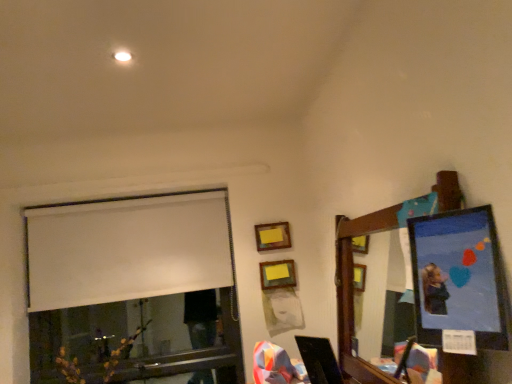
Question: Can you confirm if wooden mirror at upper right is taller than white matte window at upper left?

Choices:
 (A) no
 (B) yes

Answer: (B)

Question: From the image's perspective, is wooden mirror at upper right under white matte window at upper left?

Choices:
 (A) no
 (B) yes

Answer: (B)

Question: Is white matte window at upper left located within wooden mirror at upper right?

Choices:
 (A) yes
 (B) no

Answer: (B)

Question: Considering the relative sizes of wooden mirror at upper right and white matte window at upper left in the image provided, is wooden mirror at upper right thinner than white matte window at upper left?

Choices:
 (A) yes
 (B) no

Answer: (B)

Question: Is wooden mirror at upper right not near white matte window at upper left?

Choices:
 (A) no
 (B) yes

Answer: (B)

Question: From a real-world perspective, is wooden matte picture frame at upper center, the 2th picture frame positioned from the back, positioned above or below wooden picture frame at upper center, which is the 3th picture frame in right-to-left order?

Choices:
 (A) above
 (B) below

Answer: (B)

Question: Considering their positions, is wooden matte picture frame at upper center, the 2th picture frame positioned from the left, located in front of or behind wooden picture frame at upper center, which is the 3th picture frame in right-to-left order?

Choices:
 (A) front
 (B) behind

Answer: (A)

Question: Considering the positions of wooden matte picture frame at upper center, the second picture frame viewed from the front, and wooden picture frame at upper center, the 1th picture frame when ordered from back to front, in the image, is wooden matte picture frame at upper center, the second picture frame viewed from the front, taller or shorter than wooden picture frame at upper center, the 1th picture frame when ordered from back to front,?

Choices:
 (A) tall
 (B) short

Answer: (B)

Question: Looking at the image, does wooden matte picture frame at upper center, the 2th picture frame positioned from the back, seem bigger or smaller compared to wooden picture frame at upper center, the 1th picture frame when ordered from back to front?

Choices:
 (A) small
 (B) big

Answer: (B)

Question: Is matte plastic picture frame at upper right, the third picture frame viewed from the back, wider or thinner than white matte window at upper left?

Choices:
 (A) wide
 (B) thin

Answer: (A)

Question: In terms of size, does matte plastic picture frame at upper right, placed as the 1th picture frame when sorted from right to left, appear bigger or smaller than white matte window at upper left?

Choices:
 (A) big
 (B) small

Answer: (B)

Question: Does point (480, 332) appear closer or farther from the camera than point (123, 312)?

Choices:
 (A) closer
 (B) farther

Answer: (A)

Question: Considering their positions, is matte plastic picture frame at upper right, the third picture frame viewed from the back, located in front of or behind white matte window at upper left?

Choices:
 (A) behind
 (B) front

Answer: (B)

Question: From a real-world perspective, is wooden mirror at upper right positioned above or below wooden picture frame at upper center, which is the 3th picture frame in right-to-left order?

Choices:
 (A) below
 (B) above

Answer: (A)

Question: Choose the correct answer: Is wooden mirror at upper right inside wooden picture frame at upper center, acting as the 1th picture frame starting from the left, or outside it?

Choices:
 (A) inside
 (B) outside

Answer: (B)